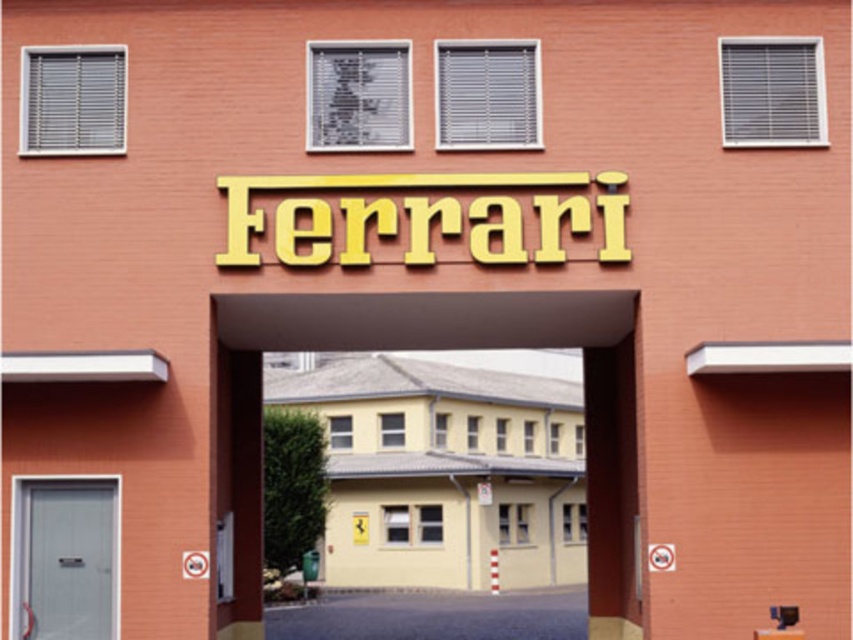
You are a delivery truck driver who needs to enter the Ferrari facility. You see the yellow matte building at center and the metallic gray door at lower left. Can your truck, which is 10 feet wide, fit through the space between them?

The yellow matte building at center and the metallic gray door at lower left are 11.36 feet apart, so yes, the truck can fit through the space between them since it is wider than the truck.

You are standing at the entrance of the Ferrari facility and looking through the archway. There are two points marked in the scene, one at coordinates point (614, 404) and another at point (25, 563). Which point is closer to your current position?

Point (25, 563) is closer to your current position because it is less further to the camera than point (614, 404).

You are a delivery driver arriving at the Ferrari facility entrance. You need to enter through the metallic gray door at lower left. However, you notice the yellow matte building at center blocking your path. Can you still access the door without going around the building?

The yellow matte building at center is positioned over the metallic gray door at lower left, meaning the door is obscured or blocked by the building. Therefore, you cannot access the metallic gray door at lower left directly without going around the building.